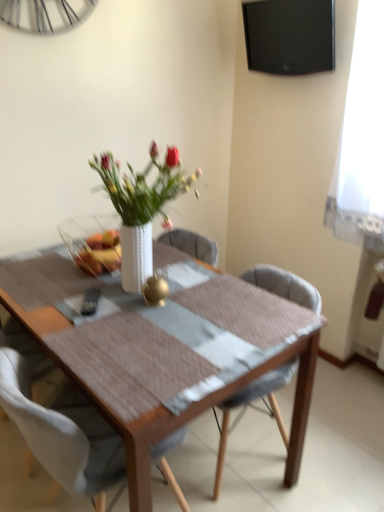
Identify the location of empty space that is ontop of light gray fabric chair at center, the 1th chair in the right-to-left sequence (from a real-world perspective). The height and width of the screenshot is (512, 384). (233, 298).